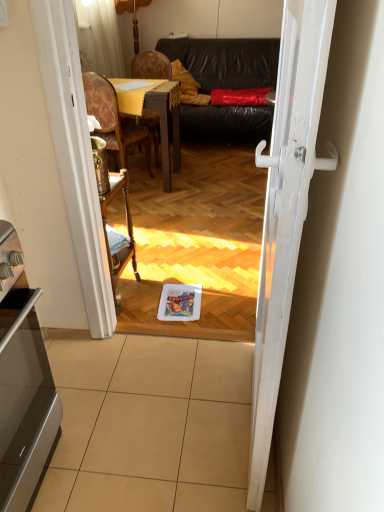
You are a GUI agent. You are given a task and a screenshot of the screen. Output one action in this format:
    pyautogui.click(x=<x>, y=<y>)
    Task: Click on the free space to the left of white glossy door at center
    
    Given the screenshot: What is the action you would take?
    pyautogui.click(x=162, y=418)